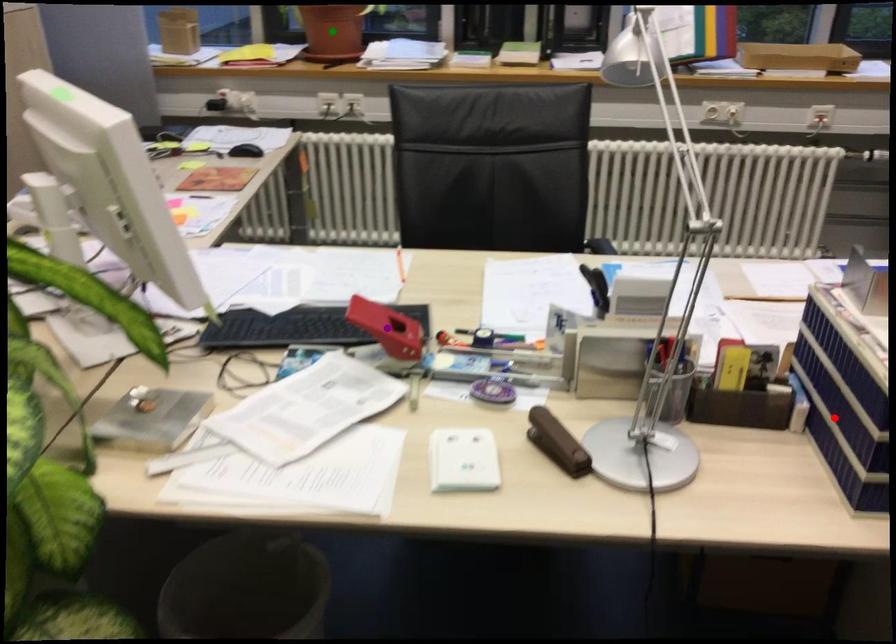
Order these from nearest to farthest:
green point | purple point | red point

red point < purple point < green point